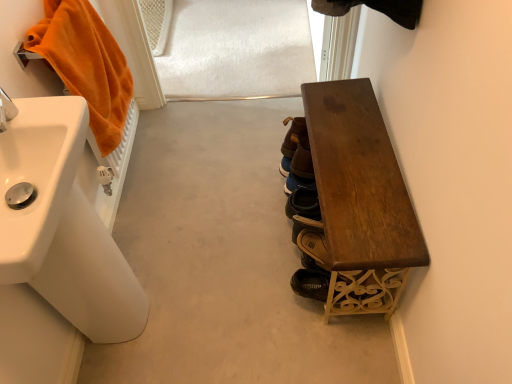
Locate an element on the screen. free space in front of white glossy sink at left, which appears as the first sink when viewed from the back is located at coordinates (129, 354).